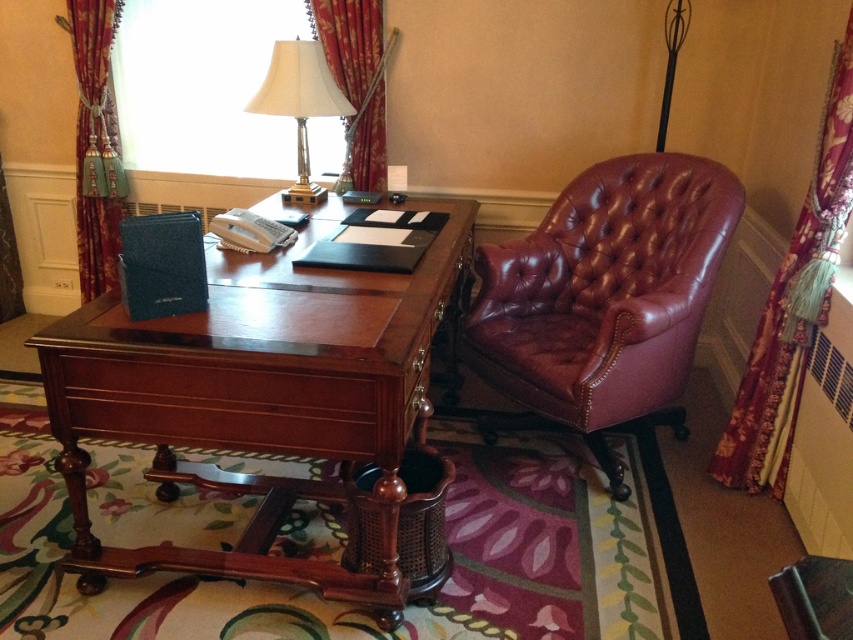
Looking at this image, you are a guest in the hotel room and want to place your laptop on the mahogany wood desk at center. However, you need to ensure that the desk is tall enough to comfortably use the laptop while sitting on the oxblood leather swivel chair at right. Based on the information provided, can you determine if the desk height is suitable for this setup?

The mahogany wood desk at center has a greater height compared to the oxblood leather swivel chair at right. Since the desk is taller than the chair, it should provide a comfortable working height for using the laptop while seated.

You are standing in the office and need to locate the velvet burgundy curtain at left. According to the scene description, where exactly is it positioned?

The velvet burgundy curtain at left is positioned at coordinates point [94,147].

You are a guest in this hotel room and want to adjust the lighting by moving the white fabric lampshade at upper center closer to the desk. However, there is a velvet burgundy curtain at left hanging above it. Can you move the lampshade without disturbing the curtain?

The velvet burgundy curtain at left is above the white fabric lampshade at upper center, so moving the lampshade closer to the desk might not disturb the curtain since it is positioned below it.